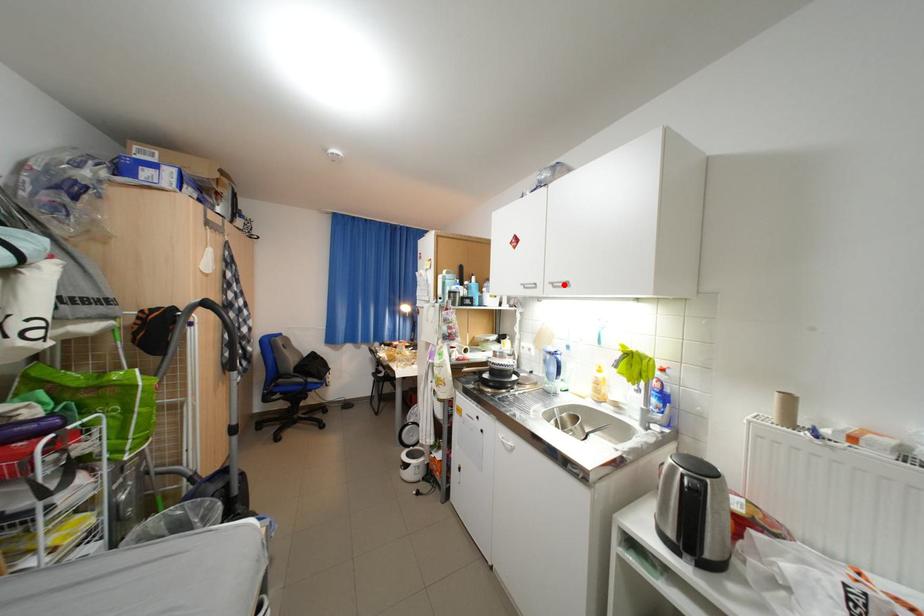
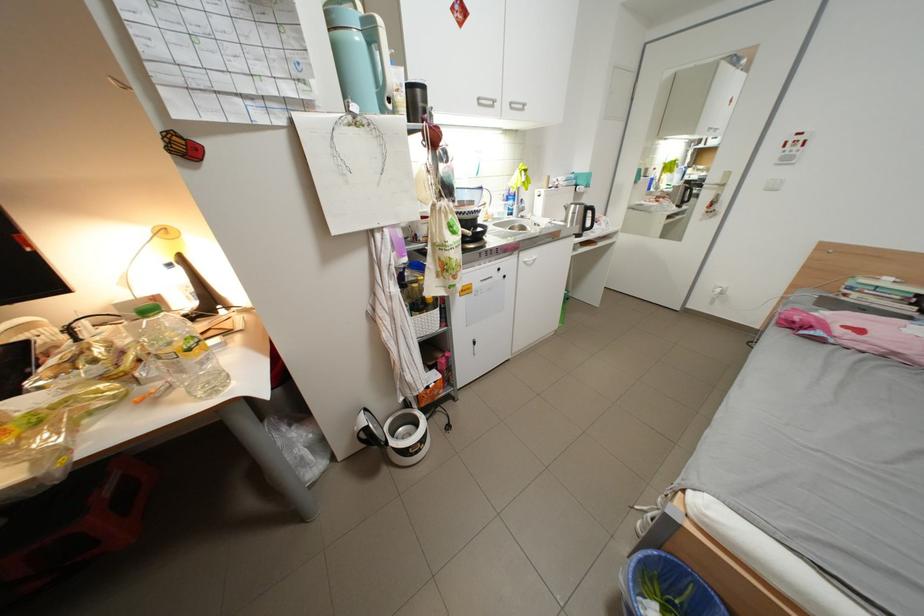
In the second image, find the point that corresponds to the highlighted location in the first image.

(523, 105)